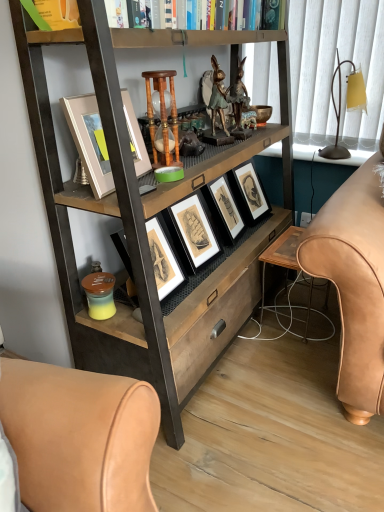
Question: From a real-world perspective, is wooden table at lower center on top of green patinated metal rabbit at center?

Choices:
 (A) no
 (B) yes

Answer: (A)

Question: Is wooden table at lower center not inside green patinated metal rabbit at center?

Choices:
 (A) no
 (B) yes

Answer: (B)

Question: Considering the relative sizes of wooden table at lower center and green patinated metal rabbit at center in the image provided, is wooden table at lower center wider than green patinated metal rabbit at center?

Choices:
 (A) no
 (B) yes

Answer: (B)

Question: Does wooden table at lower center have a lesser width compared to green patinated metal rabbit at center?

Choices:
 (A) no
 (B) yes

Answer: (A)

Question: Is wooden table at lower center directly adjacent to green patinated metal rabbit at center?

Choices:
 (A) no
 (B) yes

Answer: (A)

Question: Based on their sizes in the image, would you say matte yellow glass table lamp at right is bigger or smaller than wooden hourglass at center?

Choices:
 (A) small
 (B) big

Answer: (B)

Question: In terms of height, does matte yellow glass table lamp at right look taller or shorter compared to wooden hourglass at center?

Choices:
 (A) tall
 (B) short

Answer: (A)

Question: From the image's perspective, is matte yellow glass table lamp at right located above or below wooden hourglass at center?

Choices:
 (A) below
 (B) above

Answer: (B)

Question: Is point (350, 86) positioned closer to the camera than point (170, 96)?

Choices:
 (A) farther
 (B) closer

Answer: (A)

Question: In terms of size, does hardcover books at upper center appear bigger or smaller than matte yellow glass table lamp at right?

Choices:
 (A) big
 (B) small

Answer: (A)

Question: From the image's perspective, is hardcover books at upper center above or below matte yellow glass table lamp at right?

Choices:
 (A) below
 (B) above

Answer: (B)

Question: Relative to matte yellow glass table lamp at right, is hardcover books at upper center in front or behind?

Choices:
 (A) behind
 (B) front

Answer: (B)

Question: Is hardcover books at upper center taller or shorter than matte yellow glass table lamp at right?

Choices:
 (A) short
 (B) tall

Answer: (A)

Question: Would you say wooden hourglass at center is to the left or to the right of wooden bookcase at center in the picture?

Choices:
 (A) left
 (B) right

Answer: (A)

Question: Considering the positions of point (163, 108) and point (185, 349), is point (163, 108) closer or farther from the camera than point (185, 349)?

Choices:
 (A) closer
 (B) farther

Answer: (A)